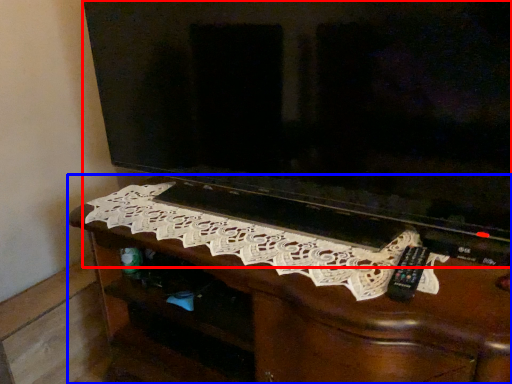
Question: Which point is closer to the camera, television (highlighted by a red box) or furniture (highlighted by a blue box)?

Choices:
 (A) television
 (B) furniture

Answer: (A)